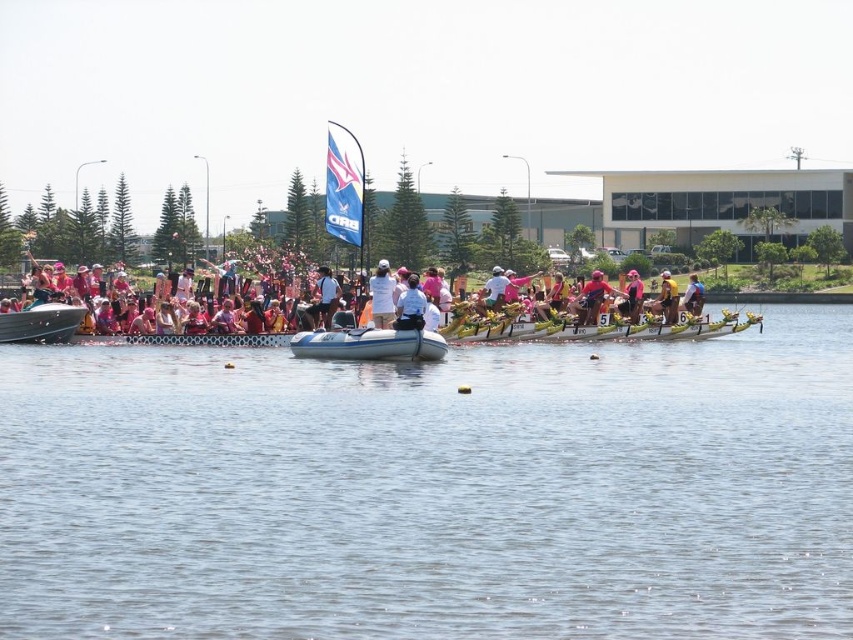
Question: Which point is closer to the camera?

Choices:
 (A) metallic silver boat at left
 (B) white cloth at center
 (C) yellow fabric shirt at center

Answer: (B)

Question: Which point is closer to the camera taking this photo?

Choices:
 (A) (374, 339)
 (B) (656, 307)
 (C) (581, 308)

Answer: (A)

Question: Does clear water at center appear under pink fabric person at center?

Choices:
 (A) yes
 (B) no

Answer: (A)

Question: Which object appears farthest from the camera in this image?

Choices:
 (A) pink fabric person at center
 (B) pink fabric helmet at center
 (C) white inflatable boat at center
 (D) metallic silver boat at left

Answer: (B)

Question: Can you confirm if clear water at center is positioned below pink fabric person at center?

Choices:
 (A) yes
 (B) no

Answer: (A)

Question: Does white cotton shirt at center have a larger size compared to yellow fabric person at center?

Choices:
 (A) yes
 (B) no

Answer: (B)